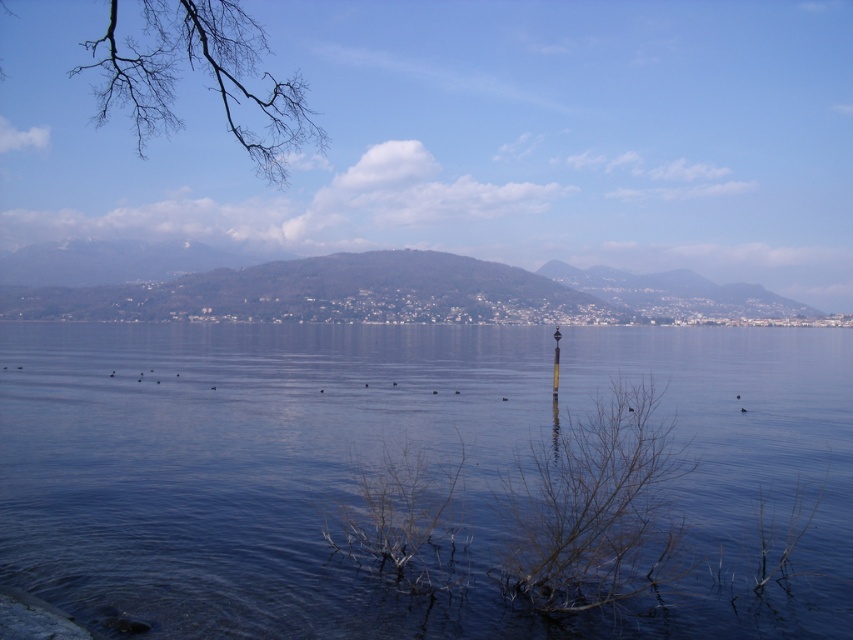
You are an observer looking at the serene lakeside scene. You notice the transparent water at center and the bare branches at upper left. Which object is closer to you, the observer?

The transparent water at center is closer to the observer because it is positioned in front of the bare branches at upper left.